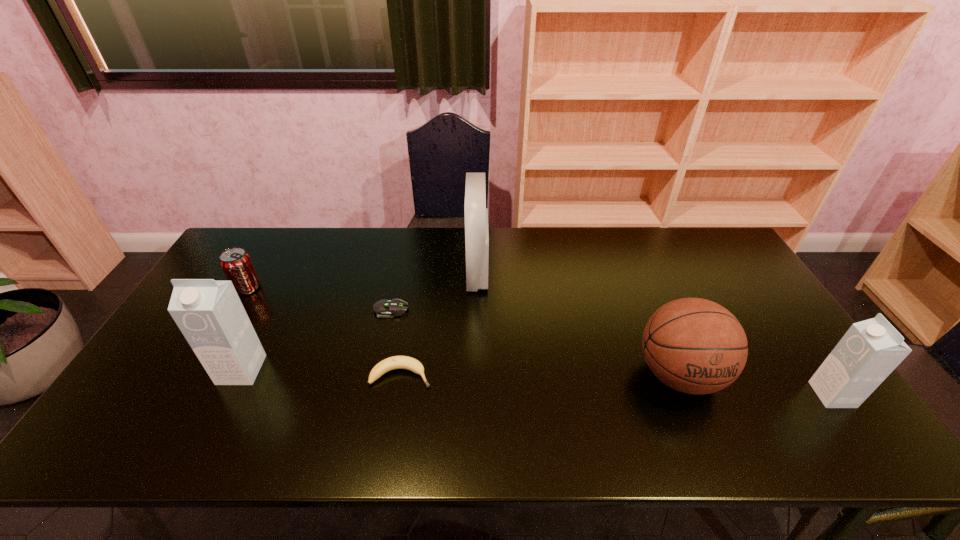
If we want them evenly spaced by inserting an extra carton among them, please locate a free spot for this new carton. Please provide its 2D coordinates. Your answer should be formatted as a tuple, i.e. [(x, y)], where the tuple contains the x and y coordinates of a point satisfying the conditions above.

[(529, 382)]